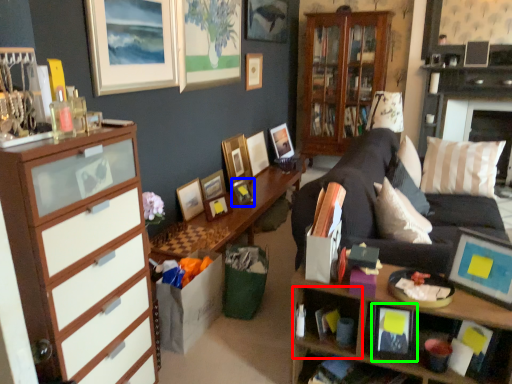
Question: Estimate the real-world distances between objects in this image. Which object is farther from cabinet (highlighted by a red box), picture frame (highlighted by a blue box) or picture frame (highlighted by a green box)?

Choices:
 (A) picture frame
 (B) picture frame

Answer: (A)